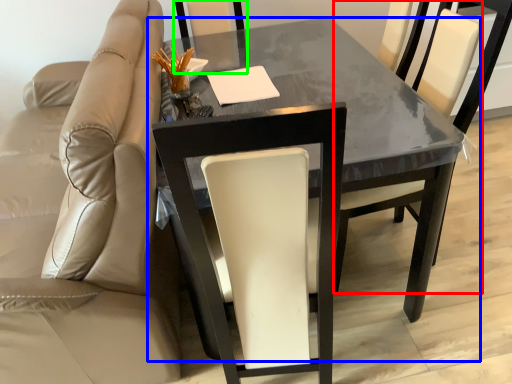
Question: Based on their relative distances, which object is nearer to chair (highlighted by a red box)? Choose from table (highlighted by a blue box) and chair (highlighted by a green box).

Choices:
 (A) table
 (B) chair

Answer: (A)